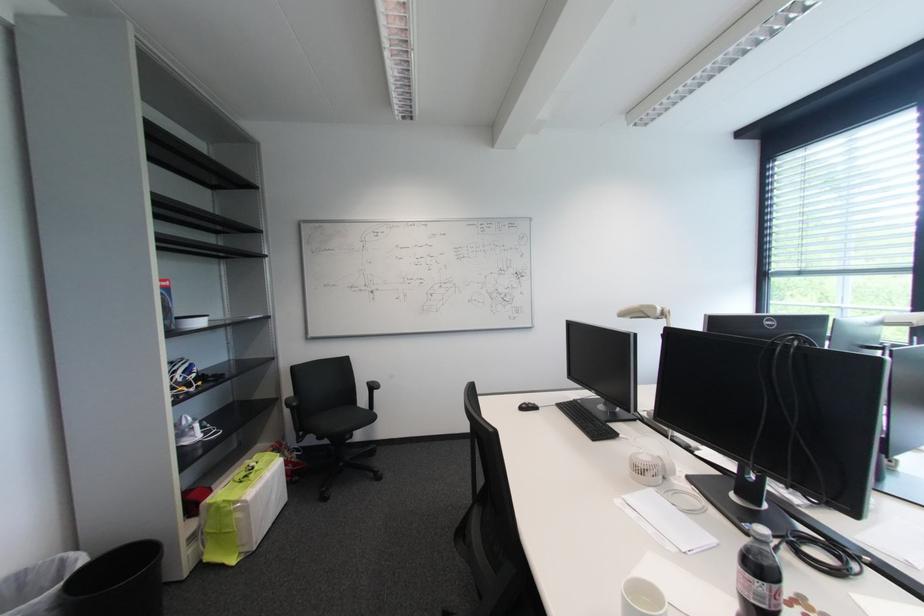
Find the location of a particular element. This screenshot has width=924, height=616. soda bottle is located at coordinates (758, 575).